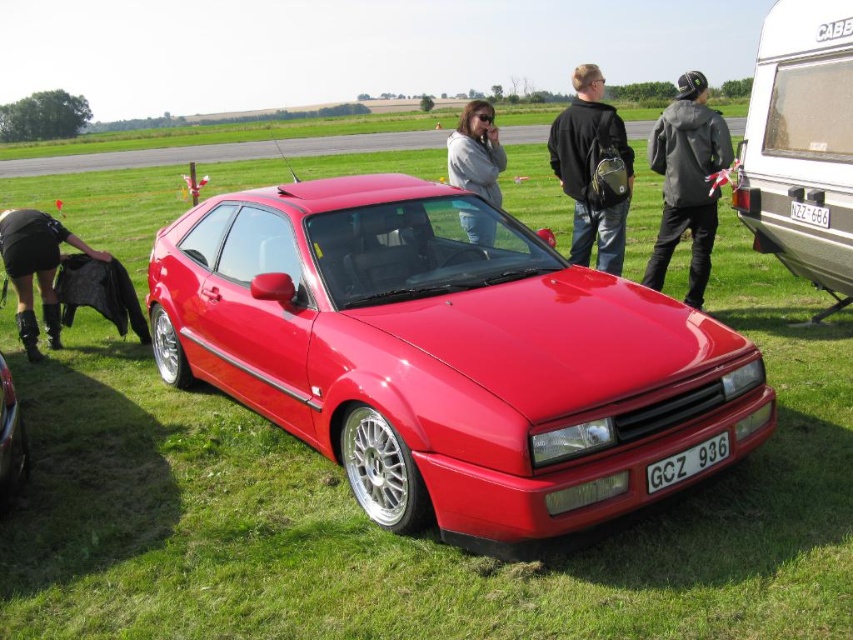
You are planning to attach a white plastic trailer at right to the back of the car. The white plastic license plate at lower center is currently mounted on the car. Will the trailer block the license plate from being visible once attached?

The white plastic trailer at right has a larger size compared to the white plastic license plate at lower center. Therefore, the trailer will likely block the license plate from being visible once attached.

You are driving a car that is 4 meters long and want to attach it to the white plastic trailer at right. Can the car and trailer fit together without overlapping?

The distance between the car and the white plastic trailer at right is 4.36 meters. Since the car is 4 meters long, there is enough space between them to attach without overlapping.